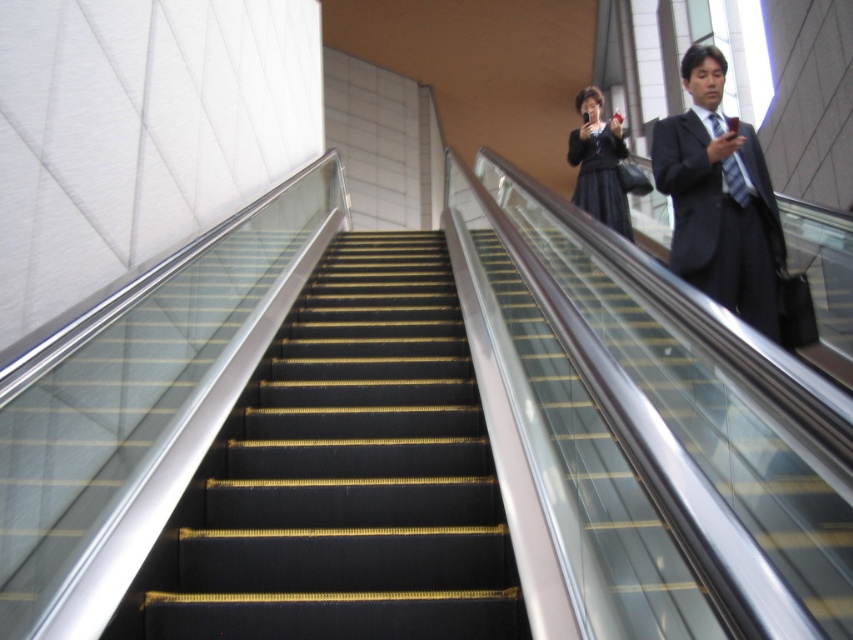
Does black rubber stairs at center appear under dark gray suit at upper right?

Correct, black rubber stairs at center is located below dark gray suit at upper right.

From the picture: Who is shorter, black rubber stairs at center or dark gray suit at upper right?

black rubber stairs at center is shorter.

Who is more distant from viewer, (227, 483) or (753, 134)?

Point (753, 134)

Where is `black rubber stairs at center`? black rubber stairs at center is located at coordinates (344, 476).